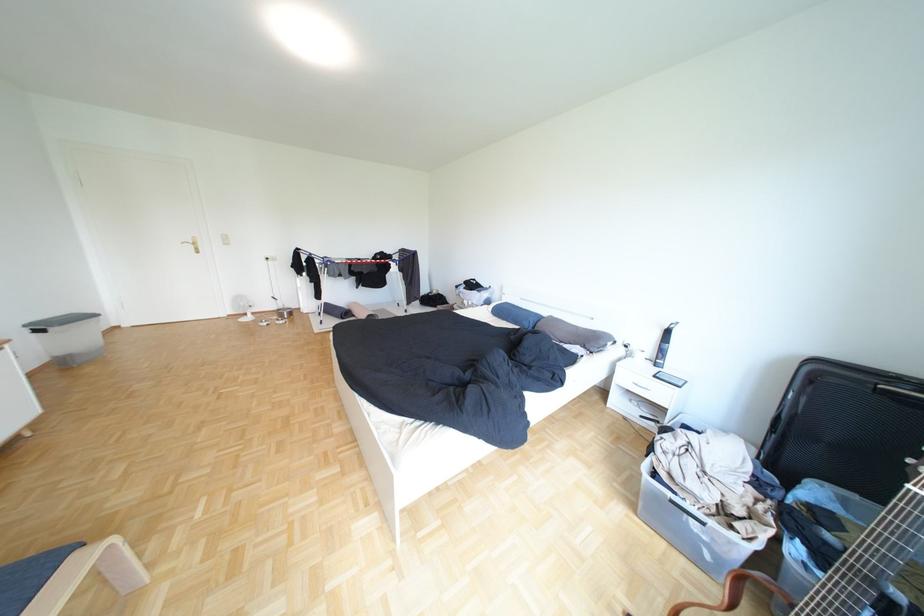
Where is `storage bin lid`? The image size is (924, 616). storage bin lid is located at coordinates (59, 320).